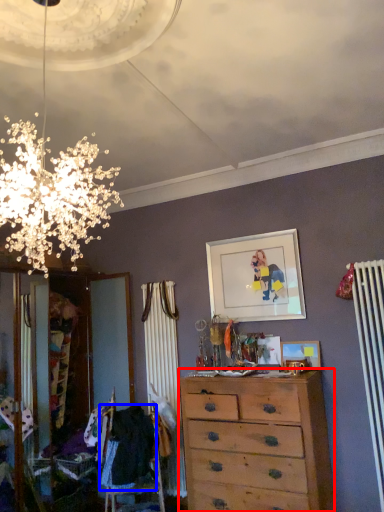
Question: Which object appears closest to the camera in this image, chest of drawers (highlighted by a red box) or clothing (highlighted by a blue box)?

Choices:
 (A) chest of drawers
 (B) clothing

Answer: (A)